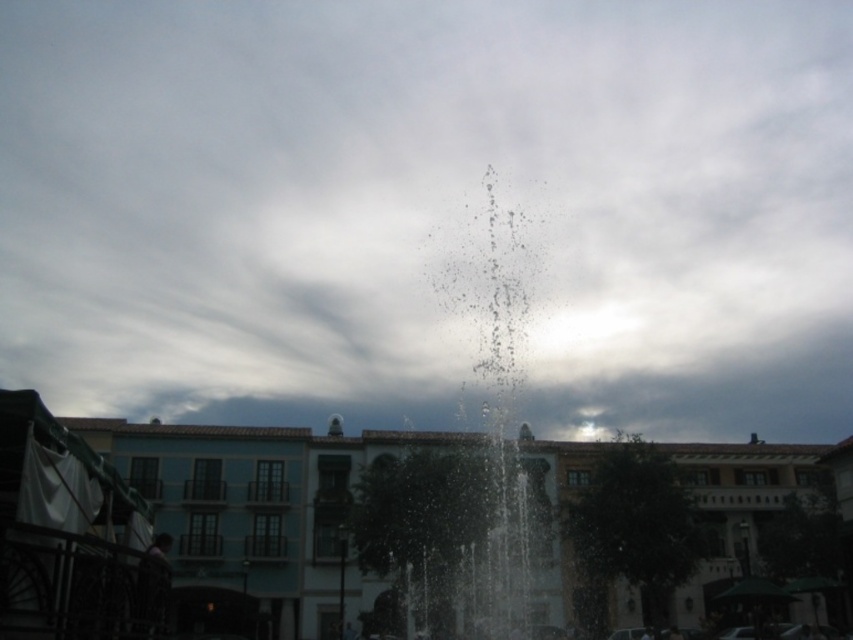
Question: Among these objects, which one is nearest to the camera?

Choices:
 (A) white fluffy cloud at center
 (B) white glossy fountain at center
 (C) clear water at center

Answer: (B)

Question: Does white fluffy cloud at center have a larger size compared to white glossy fountain at center?

Choices:
 (A) yes
 (B) no

Answer: (A)

Question: Which point appears closest to the camera in this image?

Choices:
 (A) (709, 177)
 (B) (547, 513)

Answer: (B)

Question: Does white glossy fountain at center appear over clear water at center?

Choices:
 (A) no
 (B) yes

Answer: (A)

Question: Observing the image, what is the correct spatial positioning of white glossy fountain at center in reference to clear water at center?

Choices:
 (A) right
 (B) left

Answer: (B)

Question: Among these objects, which one is nearest to the camera?

Choices:
 (A) white glossy fountain at center
 (B) clear water at center

Answer: (A)